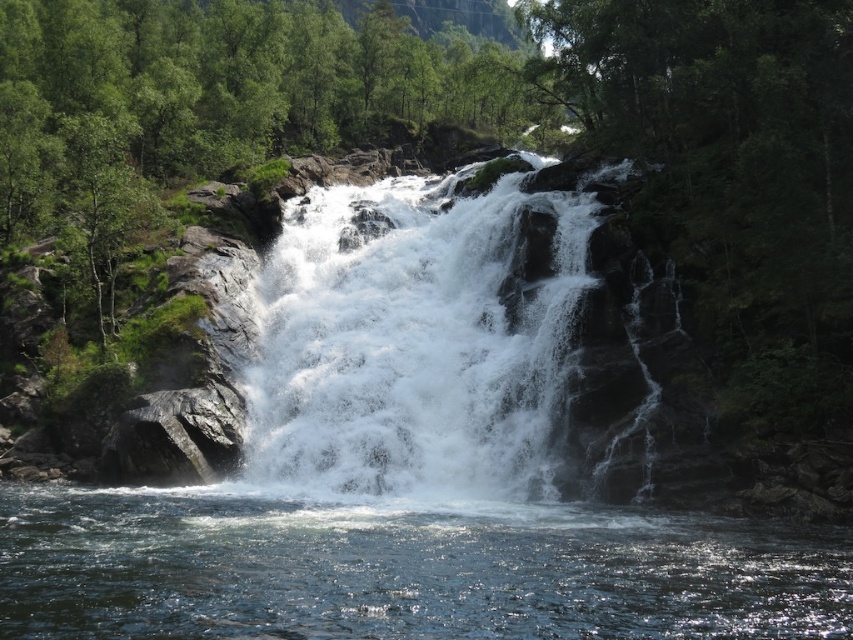
Question: Which object is positioned farthest from the clear water at center?

Choices:
 (A) green leafy tree at center
 (B) white frothy water at center

Answer: (A)

Question: Is clear water at center thinner than green leafy tree at center?

Choices:
 (A) no
 (B) yes

Answer: (B)

Question: Is green leafy tree at center to the left of white frothy water at center from the viewer's perspective?

Choices:
 (A) yes
 (B) no

Answer: (A)

Question: Does green leafy tree at center have a greater width compared to white frothy water at center?

Choices:
 (A) yes
 (B) no

Answer: (A)

Question: Which of the following is the closest to the observer?

Choices:
 (A) (450, 509)
 (B) (437, 419)
 (C) (154, 141)

Answer: (A)

Question: Estimate the real-world distances between objects in this image. Which object is closer to the white frothy water at center?

Choices:
 (A) clear water at center
 (B) green leafy tree at center

Answer: (A)